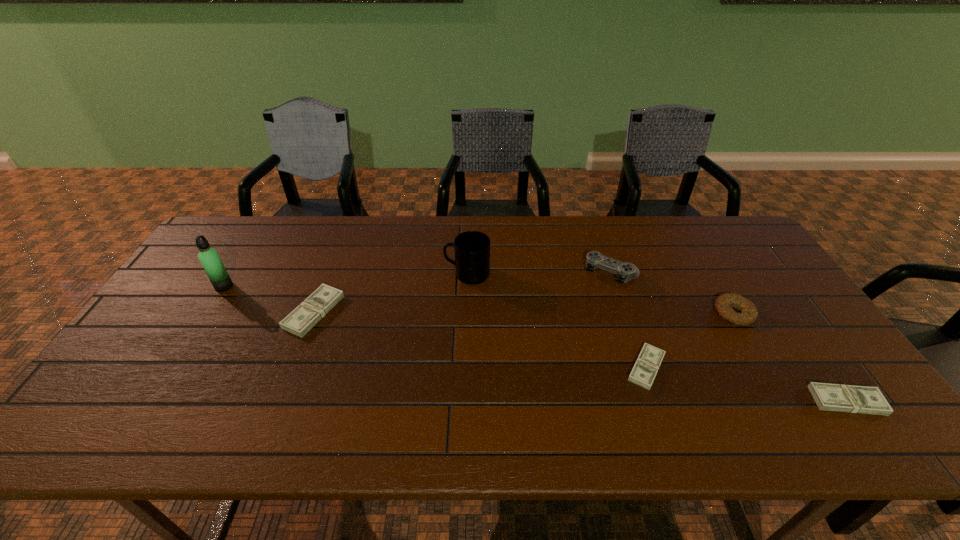
The width and height of the screenshot is (960, 540). I want to click on vacant space at the near left corner, so click(155, 401).

Find the location of a particular element. This screenshot has height=540, width=960. vacant area at the far right corner is located at coordinates 698,234.

Image resolution: width=960 pixels, height=540 pixels. Find the location of `free space at the near right corner of the desktop`. free space at the near right corner of the desktop is located at coordinates (796, 375).

Where is `blank region between the leftmost object and the control`? This screenshot has height=540, width=960. blank region between the leftmost object and the control is located at coordinates (418, 280).

At what (x,y) coordinates should I click in order to perform the action: click on free space between the rightmost money and the fourth tallest object. Please return your answer as a coordinate pair (x, y). Image resolution: width=960 pixels, height=540 pixels. Looking at the image, I should click on (790, 357).

Find the location of `free spot between the fifth object from right to left and the leftmost object`. free spot between the fifth object from right to left and the leftmost object is located at coordinates (346, 280).

Find the location of a particular element. blank region between the fifth shortest object and the second object from right to left is located at coordinates (673, 293).

The width and height of the screenshot is (960, 540). Find the location of `vacant region between the fifth object from right to left and the leftmost object`. vacant region between the fifth object from right to left and the leftmost object is located at coordinates (346, 280).

The image size is (960, 540). I want to click on free spot between the third object from left to right and the tallest object, so click(x=346, y=280).

Where is `free space between the second tallest object and the second shortest object`? The height and width of the screenshot is (540, 960). free space between the second tallest object and the second shortest object is located at coordinates (657, 338).